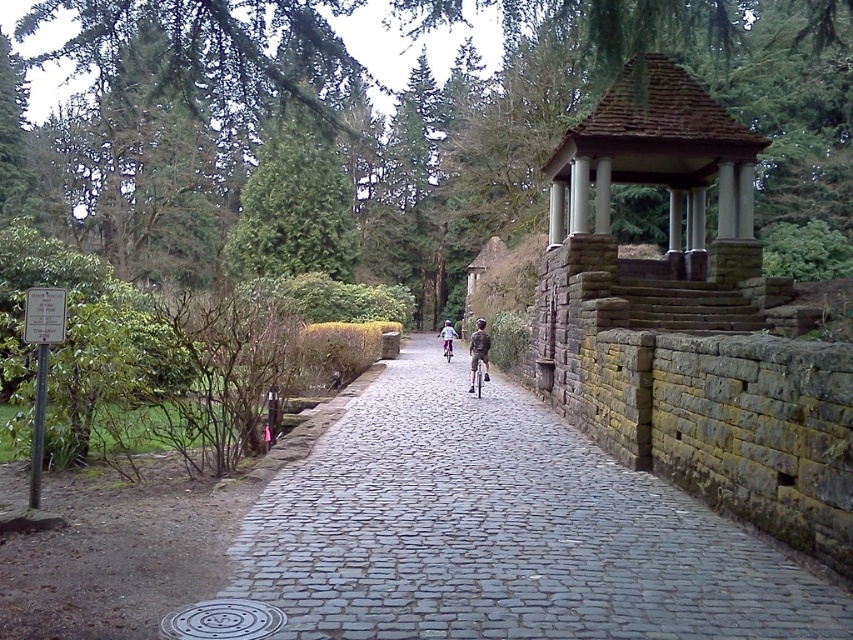
You are a hiker who just arrived at the park and see the light blue denim jacket at center and the metallic silver bicycle at center. Where is the jacket located relative to the bicycle?

The light blue denim jacket at center is to the right of the metallic silver bicycle at center.

You are standing on the cobblestone path at center and want to walk towards the gazebo. Which direction should you go relative to the khaki cotton shorts at center?

The cobblestone path at center is in front of the khaki cotton shorts at center, so you should walk forward towards the gazebo.